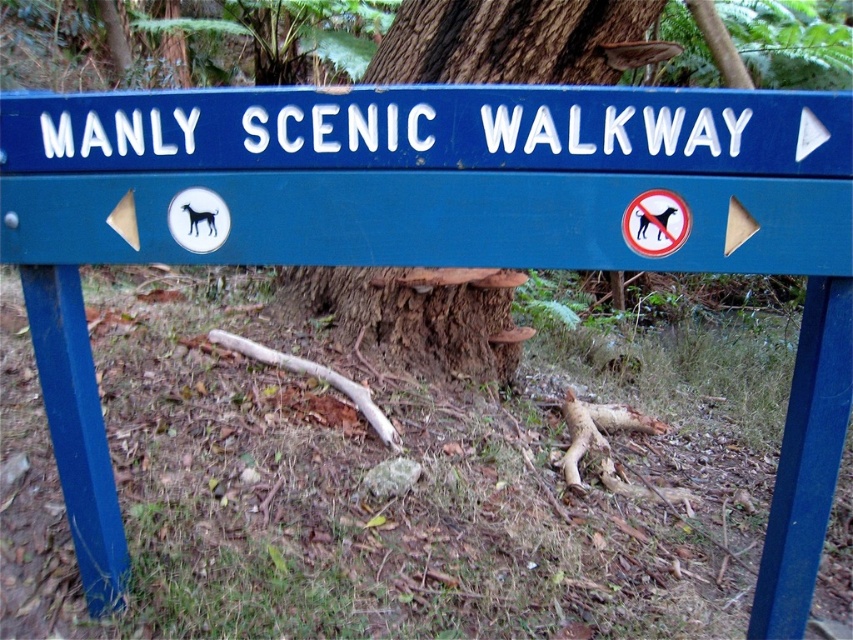
Is blue painted wood sign at center positioned in front of blue painted metal sign at upper center?

No, it is behind blue painted metal sign at upper center.

Which is below, blue painted wood sign at center or blue painted metal sign at upper center?

blue painted wood sign at center is lower down.

Which is in front, point (790, 164) or point (428, 148)?

Point (790, 164)

Where is `blue painted wood sign at center`? This screenshot has width=853, height=640. blue painted wood sign at center is located at coordinates (431, 176).

Can you confirm if blue painted wood sign at center is smaller than brown rough bark at center?

Indeed, blue painted wood sign at center has a smaller size compared to brown rough bark at center.

Does point (595, 208) lie behind point (323, 284)?

No.

Does point (134, 166) come in front of point (573, 22)?

That is True.

Locate an element on the screen. blue painted wood sign at center is located at coordinates (431, 176).

The width and height of the screenshot is (853, 640). I want to click on blue painted metal sign at upper center, so click(x=431, y=129).

Is blue painted metal sign at upper center to the right of brown rough bark at center from the viewer's perspective?

Indeed, blue painted metal sign at upper center is positioned on the right side of brown rough bark at center.

At what (x,y) coordinates should I click in order to perform the action: click on blue painted metal sign at upper center. Please return your answer as a coordinate pair (x, y). The height and width of the screenshot is (640, 853). Looking at the image, I should click on (431, 129).